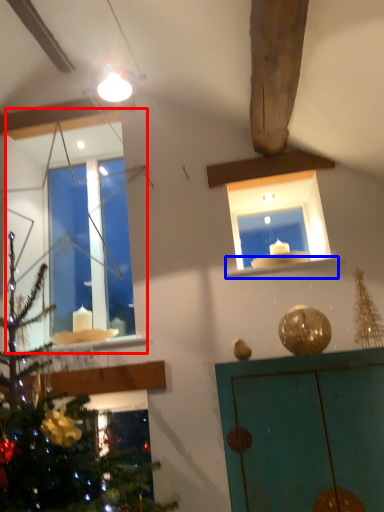
Question: Which point is further to the camera, window (highlighted by a red box) or window sill (highlighted by a blue box)?

Choices:
 (A) window
 (B) window sill

Answer: (A)